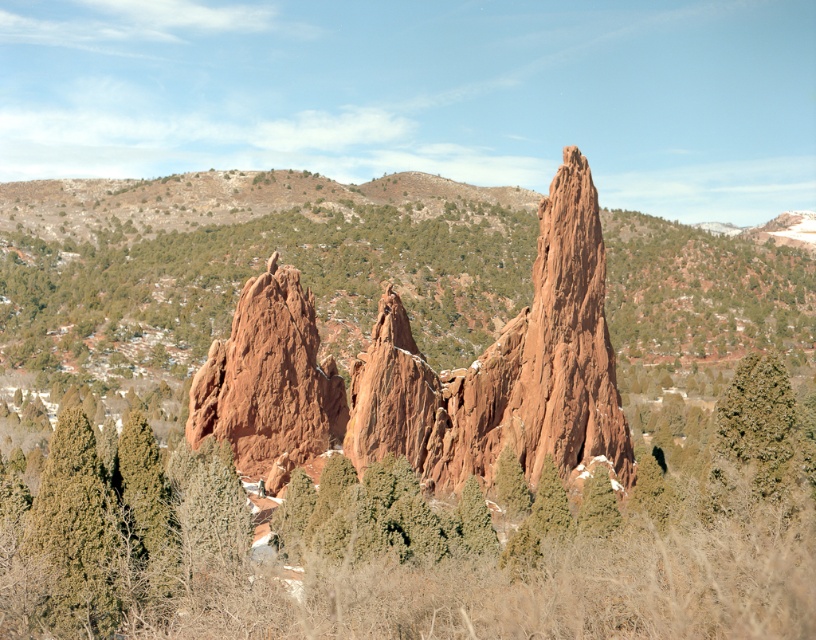
Question: Can you confirm if rustic sandstone rock formation at center is thinner than green textured pine at center?

Choices:
 (A) no
 (B) yes

Answer: (A)

Question: Is rustic sandstone rock formation at center to the right of green textured pine at center from the viewer's perspective?

Choices:
 (A) yes
 (B) no

Answer: (B)

Question: Which of the following is the farthest from the observer?

Choices:
 (A) (265, 314)
 (B) (739, 508)

Answer: (A)

Question: Can you confirm if rustic sandstone rock formation at center is positioned below green textured pine at center?

Choices:
 (A) yes
 (B) no

Answer: (B)

Question: Which of the following is the closest to the observer?

Choices:
 (A) green textured pine at center
 (B) rustic sandstone rock formation at center

Answer: (A)